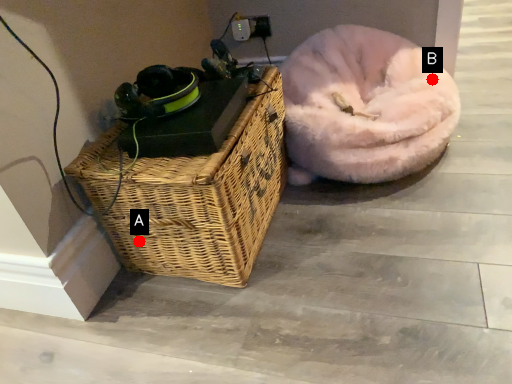
Question: Two points are circled on the image, labeled by A and B beside each circle. Which point appears closest to the camera in this image?

Choices:
 (A) A is closer
 (B) B is closer

Answer: (A)